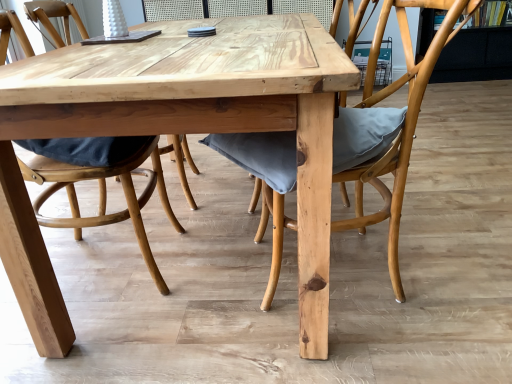
Question: Are matte gray cushion at center, which is the first chair in right-to-left order, and natural wood table at center beside each other?

Choices:
 (A) no
 (B) yes

Answer: (A)

Question: Is matte gray cushion at center, which is the first chair in right-to-left order, thinner than natural wood table at center?

Choices:
 (A) no
 (B) yes

Answer: (B)

Question: Is matte gray cushion at center, which is the first chair in right-to-left order, far away from natural wood table at center?

Choices:
 (A) yes
 (B) no

Answer: (B)

Question: Is matte gray cushion at center, the second chair viewed from the left, at the right side of natural wood table at center?

Choices:
 (A) yes
 (B) no

Answer: (A)

Question: Is matte gray cushion at center, which is the first chair in right-to-left order, facing away from natural wood table at center?

Choices:
 (A) yes
 (B) no

Answer: (B)

Question: From the image's perspective, would you say matte gray cushion at center, which is the first chair in right-to-left order, is positioned over natural wood table at center?

Choices:
 (A) no
 (B) yes

Answer: (A)

Question: Considering the relative sizes of natural wood table at center and matte gray cushion at center, which is the first chair in right-to-left order, in the image provided, is natural wood table at center wider than matte gray cushion at center, which is the first chair in right-to-left order,?

Choices:
 (A) no
 (B) yes

Answer: (B)

Question: From the image's perspective, would you say natural wood table at center is shown under matte gray cushion at center, which is the first chair in right-to-left order?

Choices:
 (A) no
 (B) yes

Answer: (A)

Question: Would you say natural wood table at center is a long distance from matte gray cushion at center, which is the first chair in right-to-left order?

Choices:
 (A) yes
 (B) no

Answer: (B)

Question: Can you confirm if natural wood table at center is smaller than matte gray cushion at center, which is the first chair in right-to-left order?

Choices:
 (A) no
 (B) yes

Answer: (A)

Question: Is natural wood table at center located outside matte gray cushion at center, which is the first chair in right-to-left order?

Choices:
 (A) yes
 (B) no

Answer: (A)

Question: Could matte gray cushion at center, the second chair viewed from the left, be considered to be inside natural wood table at center?

Choices:
 (A) yes
 (B) no

Answer: (A)

Question: Does matte wood chair at center, which is counted as the first chair, starting from the left, contain matte gray cushion at center, which is the first chair in right-to-left order?

Choices:
 (A) yes
 (B) no

Answer: (B)